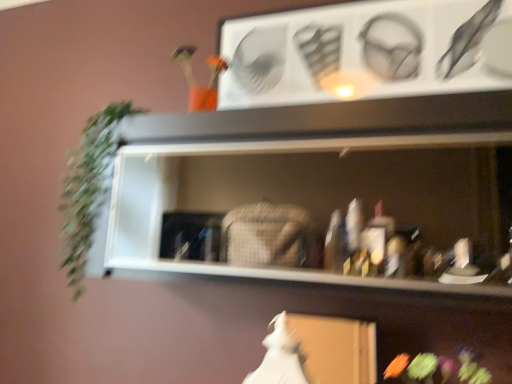
Question: Is white matte fancy dress at lower center turned away from green leafy plant at left?

Choices:
 (A) yes
 (B) no

Answer: (B)

Question: Is white matte fancy dress at lower center facing towards green leafy plant at left?

Choices:
 (A) yes
 (B) no

Answer: (B)

Question: From a real-world perspective, is white matte fancy dress at lower center physically below green leafy plant at left?

Choices:
 (A) no
 (B) yes

Answer: (B)

Question: Does white matte fancy dress at lower center have a larger size compared to green leafy plant at left?

Choices:
 (A) yes
 (B) no

Answer: (B)

Question: Is white matte fancy dress at lower center not inside green leafy plant at left?

Choices:
 (A) yes
 (B) no

Answer: (A)

Question: Are white matte fancy dress at lower center and green leafy plant at left far apart?

Choices:
 (A) no
 (B) yes

Answer: (A)

Question: Is white matte shelf at center in contact with green leafy plant at left?

Choices:
 (A) no
 (B) yes

Answer: (A)

Question: Is white matte shelf at center wider than green leafy plant at left?

Choices:
 (A) yes
 (B) no

Answer: (A)

Question: From the image's perspective, would you say white matte shelf at center is shown under green leafy plant at left?

Choices:
 (A) yes
 (B) no

Answer: (A)

Question: Considering the relative sizes of white matte shelf at center and green leafy plant at left in the image provided, is white matte shelf at center shorter than green leafy plant at left?

Choices:
 (A) no
 (B) yes

Answer: (B)

Question: Does white matte shelf at center turn towards green leafy plant at left?

Choices:
 (A) yes
 (B) no

Answer: (B)

Question: Does white matte shelf at center have a greater height compared to green leafy plant at left?

Choices:
 (A) no
 (B) yes

Answer: (A)

Question: Can white matte shelf at center be found inside white matte fancy dress at lower center?

Choices:
 (A) yes
 (B) no

Answer: (B)